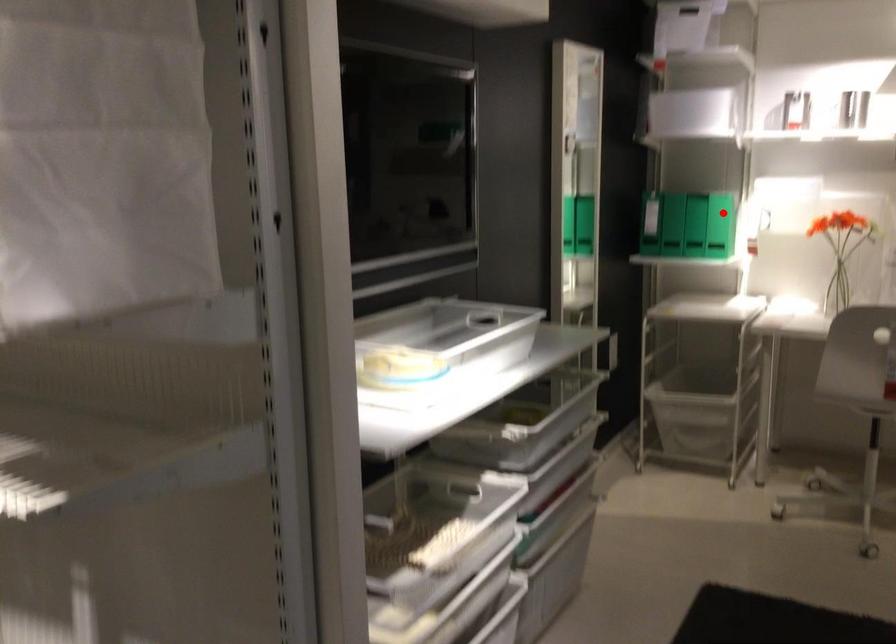
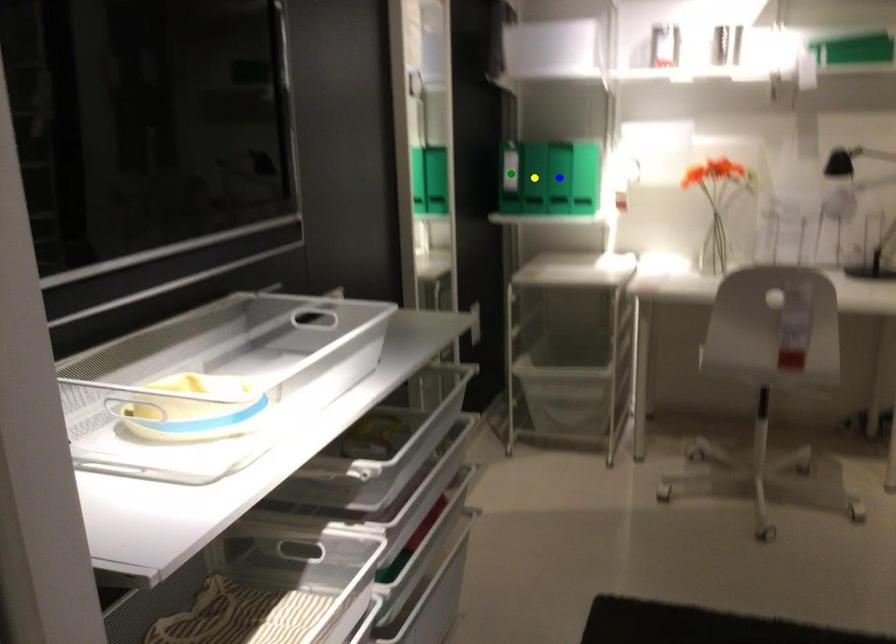
Question: I am providing you with two images of the same scene from different viewpoints. A red point is marked on the first image. You are given multiple points on the second image. Which point in image 2 represents the same 3d spot as the red point in image 1?

Choices:
 (A) yellow point
 (B) green point
 (C) blue point

Answer: (C)